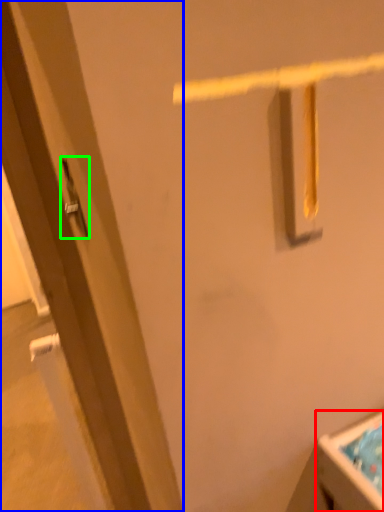
Question: Which object is positioned closest to sink (highlighted by a red box)? Select from door (highlighted by a blue box) and door handle (highlighted by a green box).

Choices:
 (A) door
 (B) door handle

Answer: (A)